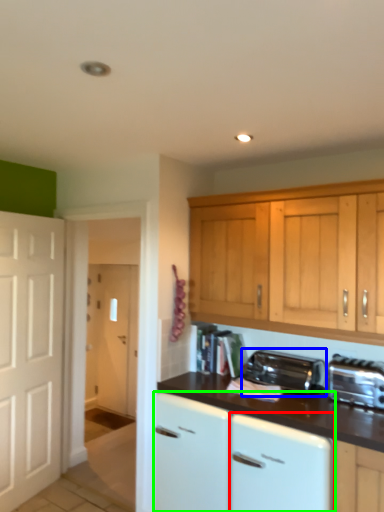
Question: Which object is the farthest from dish washer (highlighted by a red box)? Choose among these: kitchen appliance (highlighted by a blue box) or cabinetry (highlighted by a green box).

Choices:
 (A) kitchen appliance
 (B) cabinetry

Answer: (A)